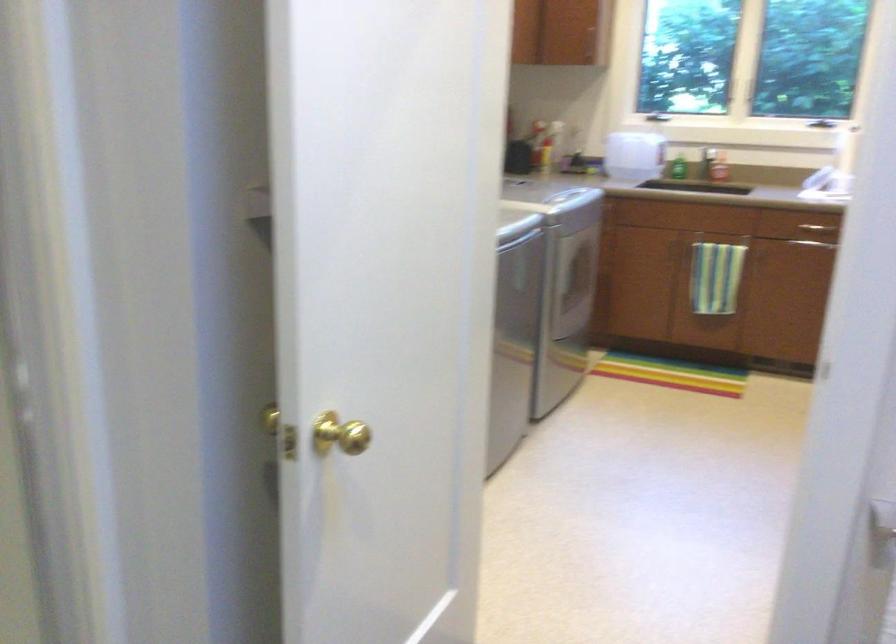
The location [633,155] corresponds to which object?

This point indicates the large plastic jug.